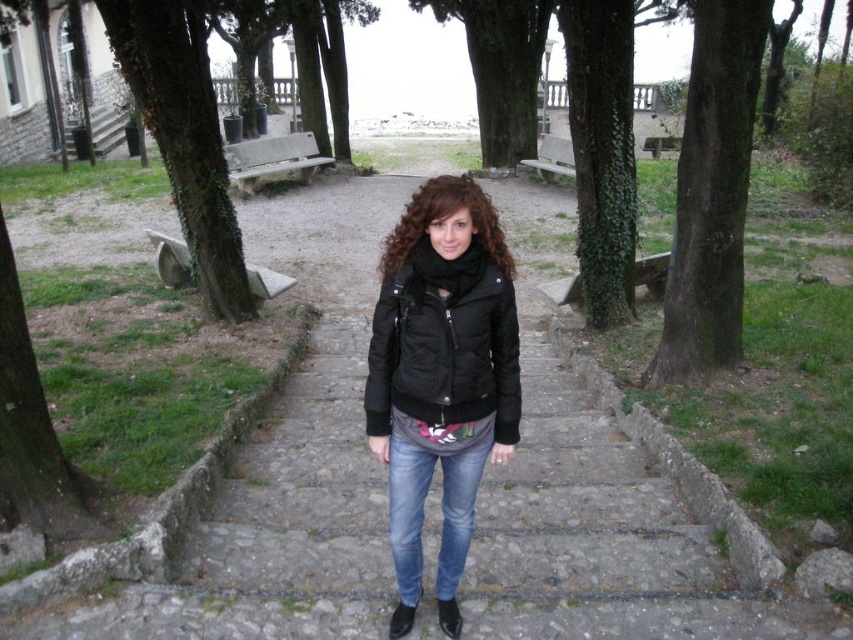
You are a photographer wanting to capture the denim jeans at center clearly. Since the green rough bark tree at center is in the way, where should you position yourself relative to the tree to ensure the jeans are visible?

To capture the denim jeans at center clearly, you should position yourself behind the green rough bark tree at center because the denim jeans are located behind it.

You are a photographer trying to capture the black quilted jacket at center and the green rough bark tree at left in the same frame. Based on their sizes, which object should you focus on first to ensure both fit well in the shot?

The black quilted jacket at center is smaller than the green rough bark tree at left, so you should focus on the green rough bark tree at left first to ensure both fit well in the shot.

You are standing at the bottom of the stone staircase in the park. You see two points marked on the staircase. The first point is at coordinate (741, 218) and the second is at (469, 508). Which point is closer to you?

Point (469, 508) is closer to you because it is in front of point (741, 218).